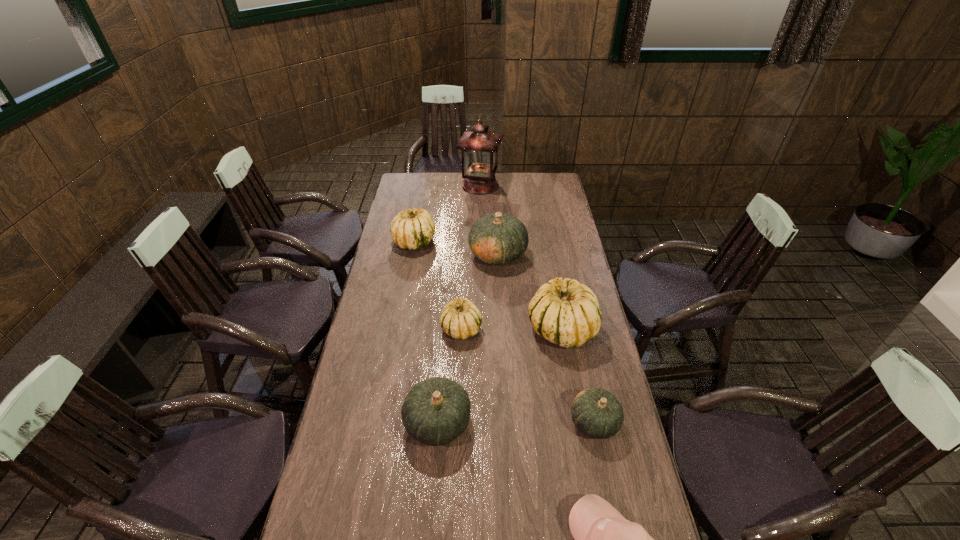
Locate an element on the screen. Image resolution: width=960 pixels, height=540 pixels. the tallest object is located at coordinates (479, 148).

Locate an element on the screen. The height and width of the screenshot is (540, 960). the farthest object is located at coordinates (479, 148).

Locate an element on the screen. The height and width of the screenshot is (540, 960). the farthest orange gourd is located at coordinates (497, 238).

Image resolution: width=960 pixels, height=540 pixels. Identify the location of the rightmost white gourd. (567, 313).

Identify the location of the second biggest orange gourd. (436, 411).

The image size is (960, 540). I want to click on the leftmost white gourd, so (x=411, y=229).

The width and height of the screenshot is (960, 540). Identify the location of the farthest white gourd. (411, 229).

Where is `the smallest orange gourd`? the smallest orange gourd is located at coordinates (597, 413).

The width and height of the screenshot is (960, 540). Find the location of `the smallest white gourd`. the smallest white gourd is located at coordinates (461, 319).

Image resolution: width=960 pixels, height=540 pixels. I want to click on vacant region located 0.280m on the right of the tallest object, so click(x=553, y=185).